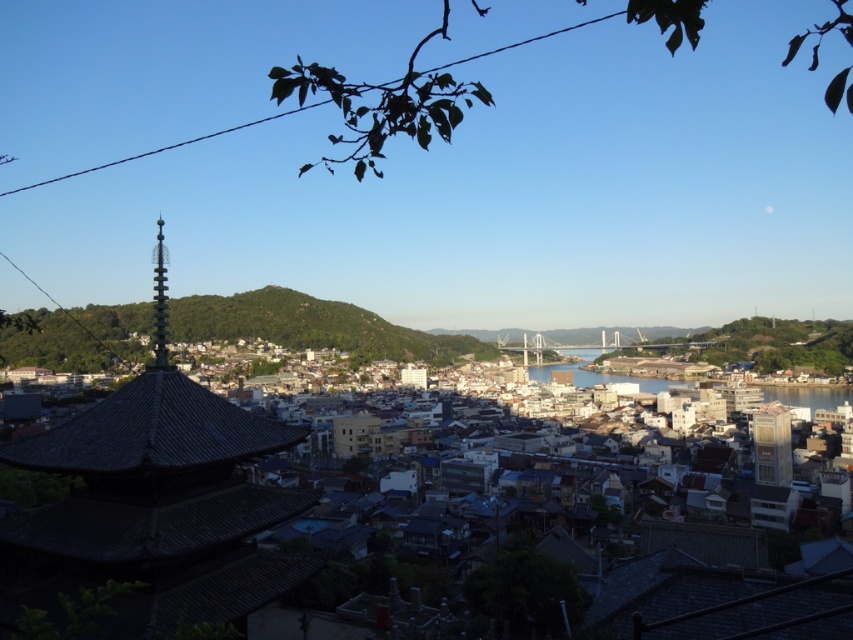
Question: Does dark gray stone pagoda at lower left come behind clear water at center?

Choices:
 (A) yes
 (B) no

Answer: (B)

Question: Which point appears farthest from the camera in this image?

Choices:
 (A) (144, 348)
 (B) (648, 378)
 (C) (32, 595)

Answer: (B)

Question: Considering the relative positions of dark gray stone pagoda at lower left and green grassy hill at center in the image provided, where is dark gray stone pagoda at lower left located with respect to green grassy hill at center?

Choices:
 (A) below
 (B) above

Answer: (A)

Question: Does dark gray stone pagoda at lower left appear over green grassy hill at center?

Choices:
 (A) yes
 (B) no

Answer: (B)

Question: Which point is farther to the camera?

Choices:
 (A) (35, 570)
 (B) (643, 380)
 (C) (88, 349)

Answer: (B)

Question: Which object appears farthest from the camera in this image?

Choices:
 (A) clear water at center
 (B) green grassy hill at center

Answer: (A)